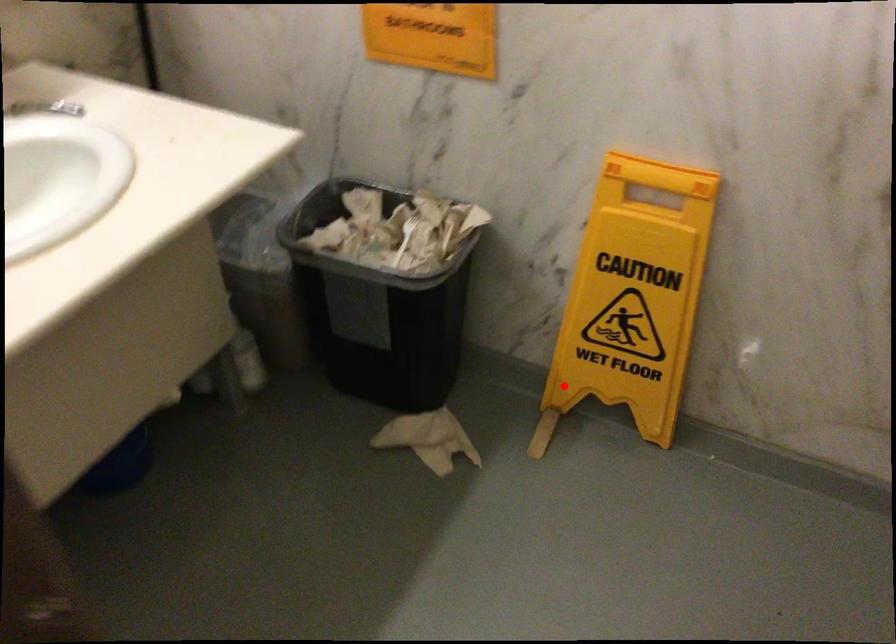
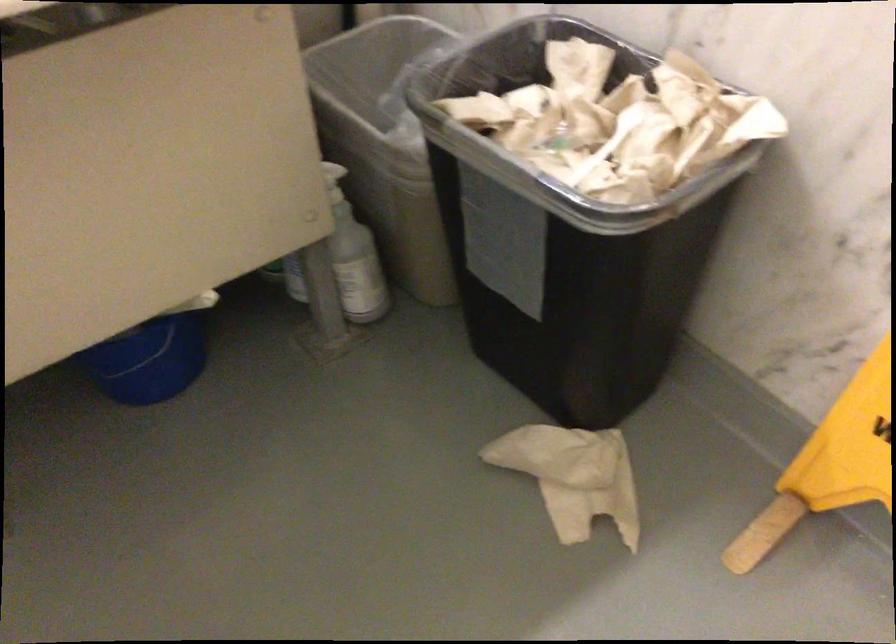
Question: I am providing you with two images of the same scene from different viewpoints. A red point is shown in image1. For the corresponding object point in image2, is it positioned nearer or farther from the camera?

Choices:
 (A) Nearer
 (B) Farther

Answer: (A)